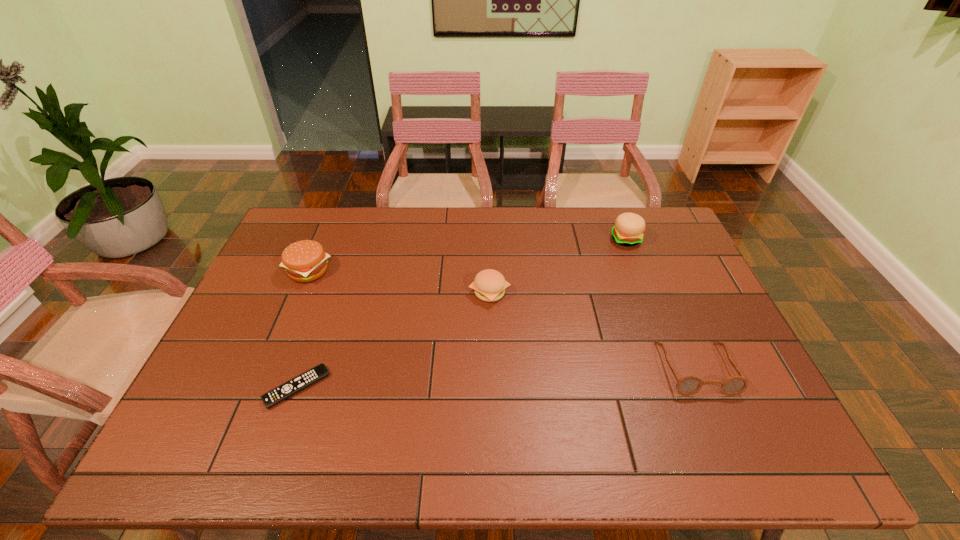
The image size is (960, 540). What are the coordinates of `free location located on the right of the remote control` in the screenshot? It's located at (424, 387).

The width and height of the screenshot is (960, 540). Identify the location of object present at the far edge. 628,230.

Where is `object that is at the left edge`? object that is at the left edge is located at coordinates (305, 260).

Where is `hamburger that is at the right edge`? hamburger that is at the right edge is located at coordinates (628, 230).

You are a GUI agent. You are given a task and a screenshot of the screen. Output one action in this format:
    pyautogui.click(x=<x>, y=<y>)
    Task: Click on the spectacles at the right edge
    
    Given the screenshot: What is the action you would take?
    pyautogui.click(x=690, y=385)

Identify the location of object present at the far right corner. (628, 230).

In the image, there is a desktop. At what (x,y) coordinates should I click in order to perform the action: click on free space at the far edge. Please return your answer as a coordinate pair (x, y). The width and height of the screenshot is (960, 540). Looking at the image, I should click on (596, 221).

I want to click on vacant space at the near edge of the desktop, so click(x=689, y=444).

This screenshot has height=540, width=960. In order to click on vacant space at the left edge of the desktop in this screenshot , I will do `click(231, 367)`.

Where is `free region at the right edge of the desktop`? The width and height of the screenshot is (960, 540). free region at the right edge of the desktop is located at coordinates (690, 307).